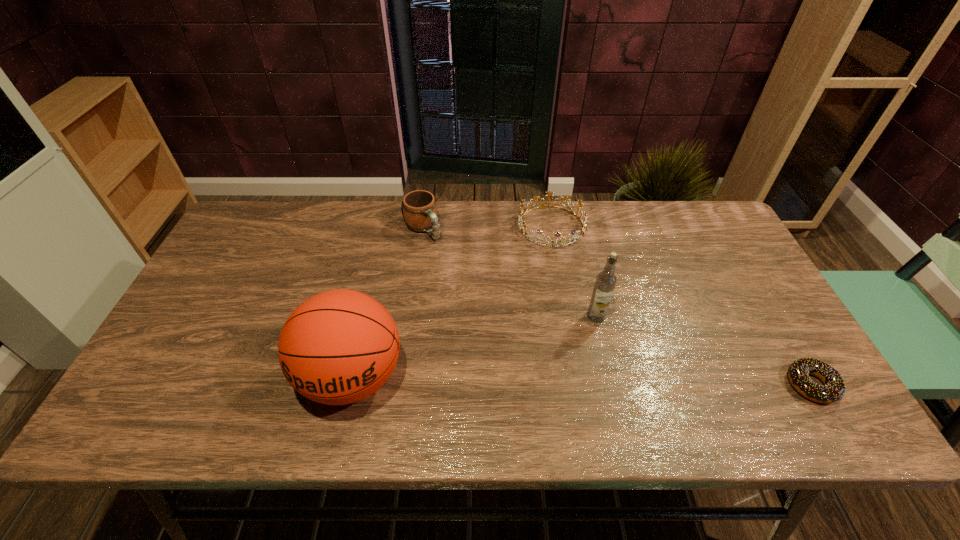
This screenshot has width=960, height=540. I want to click on free space in the image that satisfies the following two spatial constraints: 1. on the front side of the vodka; 2. on the left side of the shortest object, so click(612, 384).

Find the location of `free space in the image that satisfies the following two spatial constraints: 1. on the back side of the mug; 2. on the right side of the second shortest object`. free space in the image that satisfies the following two spatial constraints: 1. on the back side of the mug; 2. on the right side of the second shortest object is located at coordinates (423, 226).